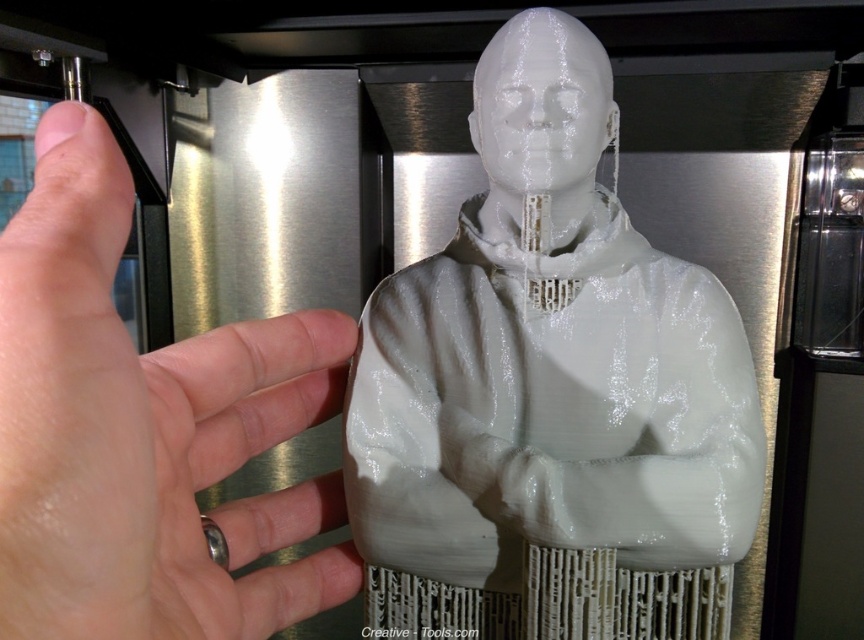
Question: Which of the following is the closest to the observer?

Choices:
 (A) white matte hand at upper left
 (B) white glossy bust at center

Answer: (A)

Question: Is white glossy bust at center smaller than white matte hand at upper left?

Choices:
 (A) yes
 (B) no

Answer: (B)

Question: Which object is farther from the camera taking this photo?

Choices:
 (A) white glossy bust at center
 (B) white matte hand at upper left

Answer: (A)

Question: Is white glossy bust at center smaller than white matte hand at upper left?

Choices:
 (A) yes
 (B) no

Answer: (B)

Question: From the image, what is the correct spatial relationship of white glossy bust at center in relation to white matte hand at upper left?

Choices:
 (A) left
 (B) right

Answer: (B)